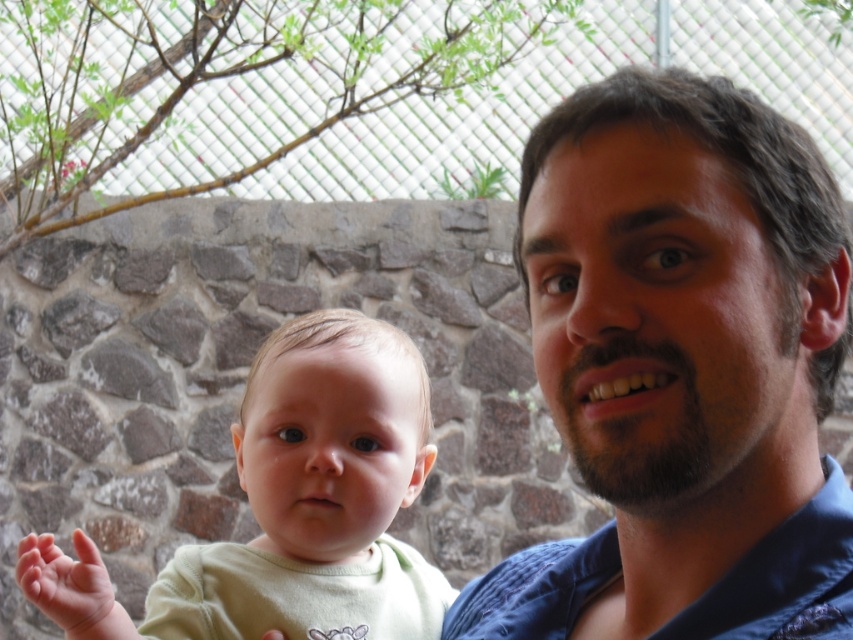
Between dark blue fabric at center and light green fabric baby at center, which one has less height?

Standing shorter between the two is light green fabric baby at center.

In the scene shown: Who is more distant from viewer, (x=833, y=189) or (x=384, y=372)?

The point (x=384, y=372) is more distant.

The width and height of the screenshot is (853, 640). In order to click on dark blue fabric at center in this screenshot , I will do `click(682, 368)`.

Can you confirm if dark blue fabric at center is positioned to the left of soft pink skin at lower left?

No, dark blue fabric at center is not to the left of soft pink skin at lower left.

Which of these two, dark blue fabric at center or soft pink skin at lower left, stands taller?

With more height is dark blue fabric at center.

Does point (619, 163) lie behind point (61, 618)?

No, (619, 163) is closer to viewer.

The image size is (853, 640). Identify the location of dark blue fabric at center. (682, 368).

In the scene shown: Who is higher up, light green fabric baby at center or soft pink skin at lower left?

light green fabric baby at center

This screenshot has width=853, height=640. Describe the element at coordinates (289, 508) in the screenshot. I see `light green fabric baby at center` at that location.

This screenshot has width=853, height=640. What are the coordinates of `light green fabric baby at center` in the screenshot? It's located at (289, 508).